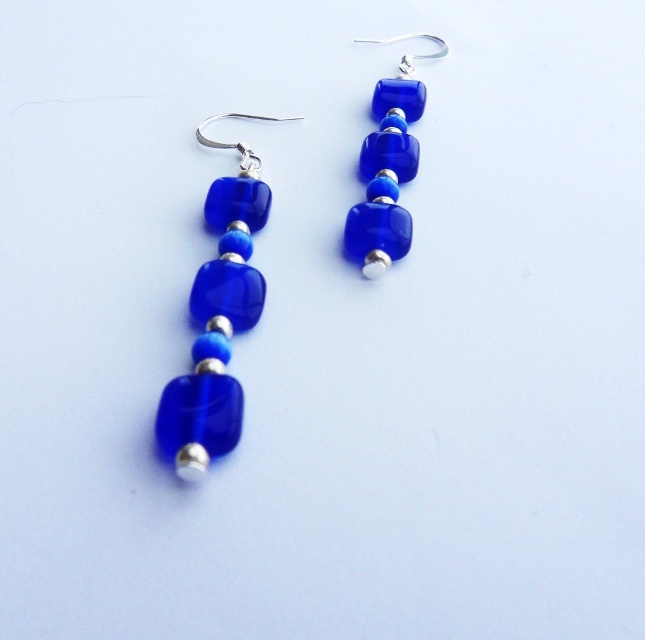
Question: Which point is closer to the camera taking this photo?

Choices:
 (A) (223, 410)
 (B) (353, 237)

Answer: (A)

Question: Which point is closer to the camera?

Choices:
 (A) cobalt glass bead at left
 (B) cobalt glass cube at center

Answer: (A)

Question: Which point is closer to the camera?

Choices:
 (A) cobalt glass cube at center
 (B) cobalt glass bead at left

Answer: (B)

Question: Is cobalt glass bead at left positioned at the back of cobalt glass cube at center?

Choices:
 (A) yes
 (B) no

Answer: (B)

Question: Does cobalt glass bead at left have a larger size compared to cobalt glass cube at center?

Choices:
 (A) yes
 (B) no

Answer: (A)

Question: Does cobalt glass bead at left come behind cobalt glass cube at center?

Choices:
 (A) yes
 (B) no

Answer: (B)